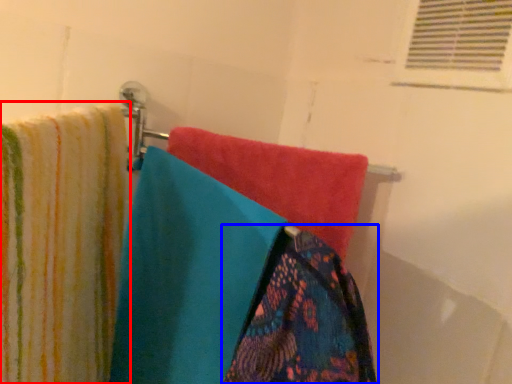
Question: Which object is further to the camera taking this photo, towel (highlighted by a red box) or towel (highlighted by a blue box)?

Choices:
 (A) towel
 (B) towel

Answer: (B)